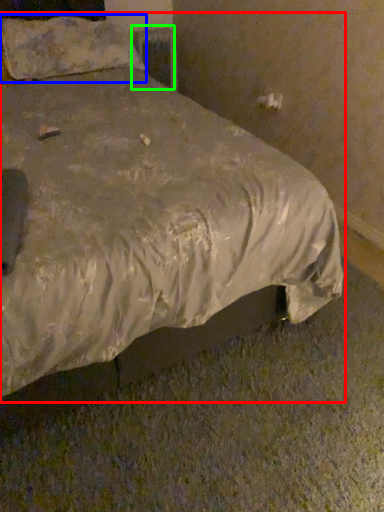
Question: Considering the real-world distances, which object is closest to bed (highlighted by a red box)? pillow (highlighted by a blue box) or radiator (highlighted by a green box).

Choices:
 (A) pillow
 (B) radiator

Answer: (A)